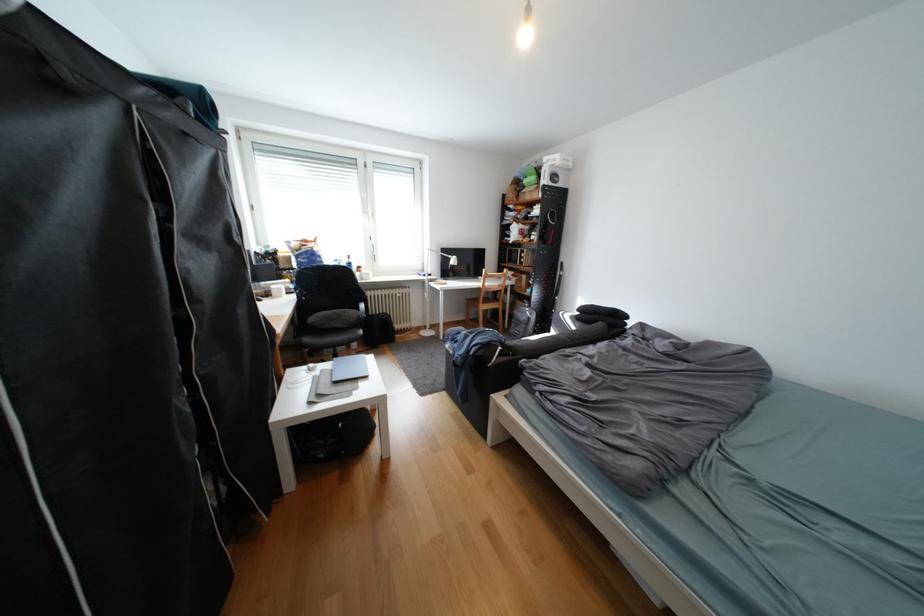
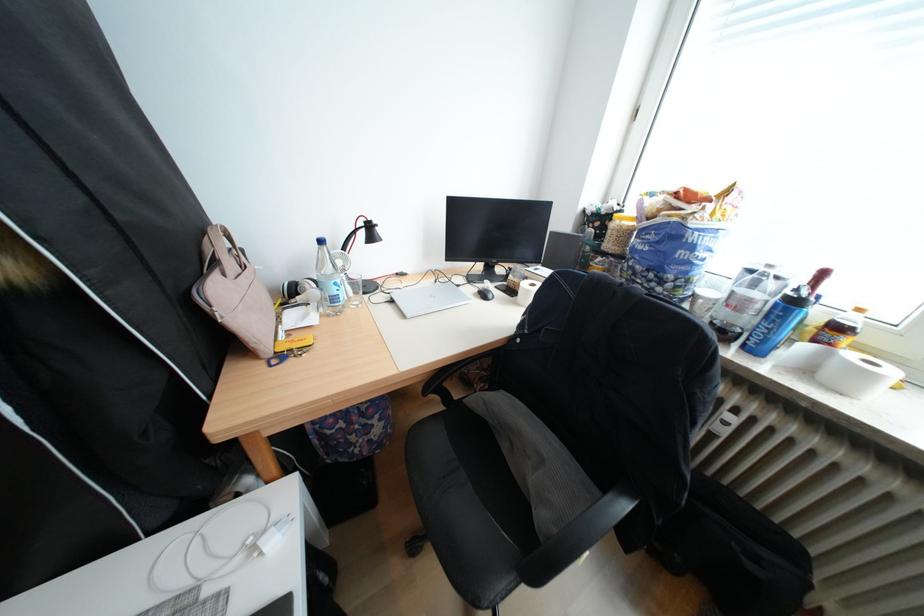
In the second image, find the point that corresponds to point 362,265 in the first image.

(808, 302)